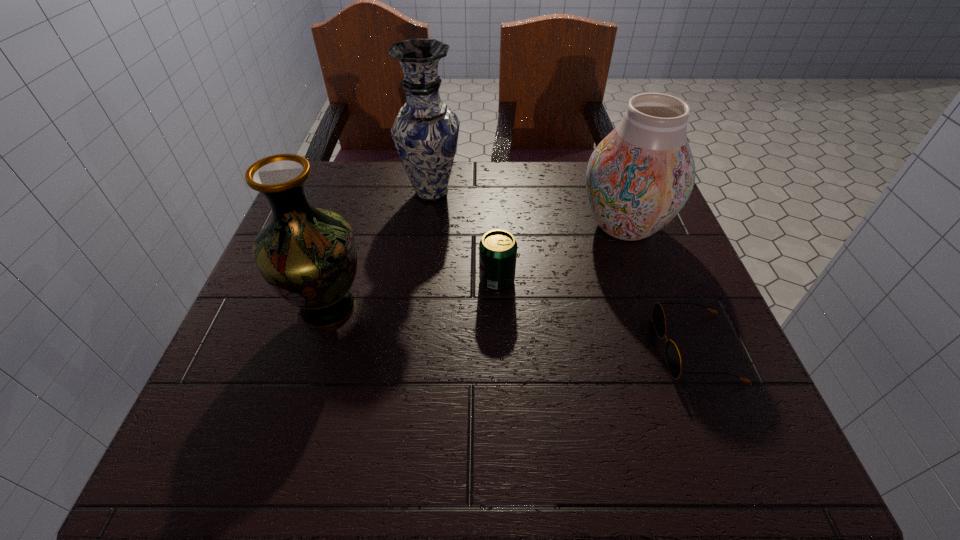
Locate an element on the screen. The width and height of the screenshot is (960, 540). free point located 0.310m on the front of the beer can is located at coordinates pos(503,442).

The height and width of the screenshot is (540, 960). What are the coordinates of `vacant space located 0.230m on the front-facing side of the sunglasses` in the screenshot? It's located at (533, 348).

I want to click on blank space located 0.190m on the front-facing side of the sunglasses, so click(554, 348).

At what (x,y) coordinates should I click in order to perform the action: click on free space located 0.100m on the front-facing side of the sunglasses. Please return your answer as a coordinate pair (x, y). Looking at the image, I should click on (604, 348).

Locate an element on the screen. This screenshot has width=960, height=540. object that is at the left edge is located at coordinates (307, 255).

I want to click on vase situated at the right edge, so click(x=639, y=177).

At what (x,y) coordinates should I click in order to perform the action: click on sunglasses at the right edge. Please return your answer as a coordinate pair (x, y). The image size is (960, 540). Looking at the image, I should click on (672, 354).

This screenshot has height=540, width=960. Identify the location of object that is at the far right corner. (639, 177).

At what (x,y) coordinates should I click in order to perform the action: click on free space at the far edge of the desktop. Please return your answer as a coordinate pair (x, y). This screenshot has width=960, height=540. Looking at the image, I should click on (391, 190).

The width and height of the screenshot is (960, 540). Identify the location of free space at the near edge of the desktop. (300, 438).